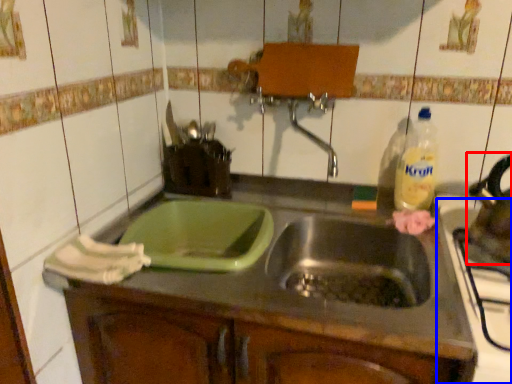
Question: Which object appears closest to the camera in this image, tea pot (highlighted by a red box) or appliance (highlighted by a blue box)?

Choices:
 (A) tea pot
 (B) appliance

Answer: (B)